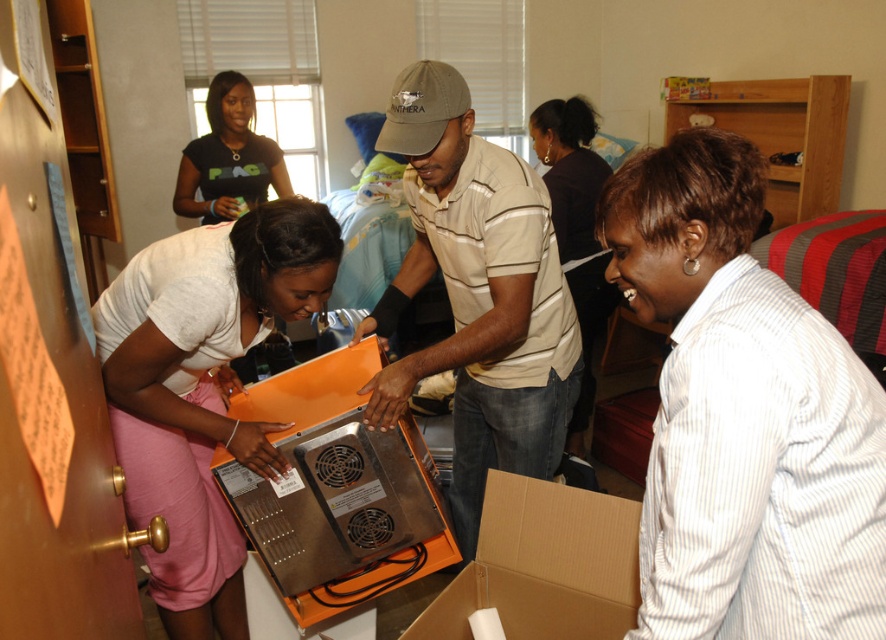
Question: Is white striped shirt at lower right above matte beige shirt at center?

Choices:
 (A) no
 (B) yes

Answer: (B)

Question: Which point is farther to the camera?

Choices:
 (A) light beige shirt at center
 (B) matte beige shirt at center

Answer: (A)

Question: Does matte white shirt at left have a lesser width compared to cardboard at lower center?

Choices:
 (A) no
 (B) yes

Answer: (A)

Question: Is matte beige shirt at center below matte black shirt at upper left?

Choices:
 (A) no
 (B) yes

Answer: (B)

Question: Which point is closer to the camera?

Choices:
 (A) 201,481
 (B) 874,506

Answer: (B)

Question: Among these objects, which one is nearest to the camera?

Choices:
 (A) cardboard at lower center
 (B) matte black shirt at upper left
 (C) matte beige shirt at center
 (D) light beige shirt at center

Answer: (A)